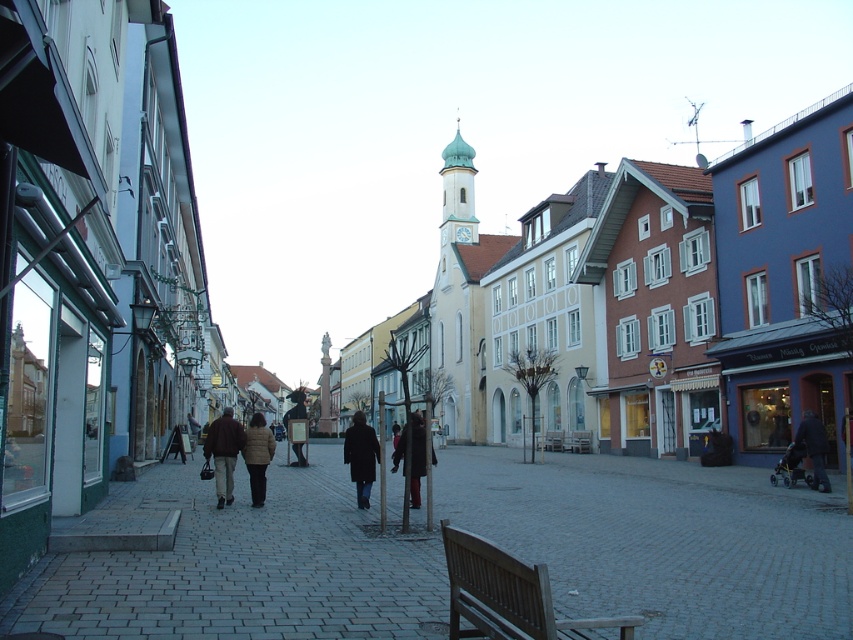
Can you confirm if brown leather jacket at center is bigger than dark brown leather jacket at center?

Actually, brown leather jacket at center might be smaller than dark brown leather jacket at center.

Is point (218, 433) positioned behind point (296, 406)?

No.

Where is `brown leather jacket at center`? This screenshot has height=640, width=853. brown leather jacket at center is located at coordinates (224, 452).

Locate an element on the screen. This screenshot has width=853, height=640. brown leather jacket at center is located at coordinates (224, 452).

Is point (402, 465) closer to camera compared to point (305, 433)?

Yes.

Who is positioned more to the left, dark gray coat at center or dark brown leather jacket at center?

Positioned to the left is dark brown leather jacket at center.

Which is in front, point (352, 452) or point (294, 436)?

Point (352, 452) is in front.

Where is `dark gray coat at center`? This screenshot has height=640, width=853. dark gray coat at center is located at coordinates (413, 454).

Does brown wooden bench at lower center have a greater height compared to dark brown leather jacket at center?

No.

Is point (451, 556) farther from camera compared to point (287, 422)?

No, (451, 556) is closer to viewer.

Is point (456, 593) in front of point (294, 403)?

That is True.

Find the location of a particular element. This screenshot has width=853, height=640. brown wooden bench at lower center is located at coordinates (508, 595).